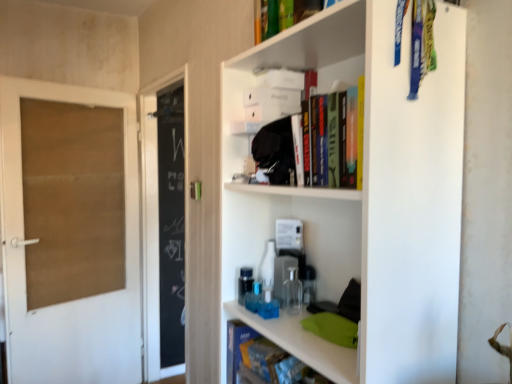
Where is `white matte shelf at upper right`? white matte shelf at upper right is located at coordinates tap(364, 196).

I want to click on brown cardboard door at left, so click(x=76, y=300).

Which is more to the right, hardcover book at upper center, positioned as the 2th book in back-to-front order, or blue matte book at lower center, which ranks as the first book in bottom-to-top order?

From the viewer's perspective, hardcover book at upper center, positioned as the 2th book in back-to-front order, appears more on the right side.

Does point (279, 17) come behind point (239, 322)?

No, (279, 17) is closer to viewer.

Measure the distance from hardcover book at upper center, positioned as the 2th book in back-to-front order, to blue matte book at lower center, which is the second book from top to bottom.

They are 30.84 inches apart.

Is hardcover book at upper center, positioned as the 2th book in back-to-front order, taller than blue matte book at lower center, which ranks as the first book in bottom-to-top order?

Correct, hardcover book at upper center, positioned as the 2th book in back-to-front order, is much taller as blue matte book at lower center, which ranks as the first book in bottom-to-top order.

Which is correct: white matte shelf at upper right is inside hardcover book at upper center, positioned as the 2th book in back-to-front order, or outside of it?

white matte shelf at upper right is spatially situated outside hardcover book at upper center, positioned as the 2th book in back-to-front order.

How many degrees apart are the facing directions of white matte shelf at upper right and hardcover book at upper center, the 2th book in the bottom-to-top sequence?

The angular difference between white matte shelf at upper right and hardcover book at upper center, the 2th book in the bottom-to-top sequence, is 3 degrees.

Is the depth of white matte shelf at upper right greater than that of hardcover book at upper center, positioned as the 2th book in back-to-front order?

No, white matte shelf at upper right is closer to the viewer.

From the image's perspective, is blue matte book at lower center, which is the second book from top to bottom, below hardcover book at upper center, arranged as the first book when viewed from the top?

Yes, from the image's perspective, blue matte book at lower center, which is the second book from top to bottom, is below hardcover book at upper center, arranged as the first book when viewed from the top.

Based on their positions, is blue matte book at lower center, positioned as the 2th book in front-to-back order, located to the left or right of hardcover book at upper center, positioned as the 2th book in back-to-front order?

blue matte book at lower center, positioned as the 2th book in front-to-back order, is to the left of hardcover book at upper center, positioned as the 2th book in back-to-front order.

Does blue matte book at lower center, positioned as the 2th book in front-to-back order, have a smaller size compared to hardcover book at upper center, positioned as the 2th book in back-to-front order?

Yes.

Is brown cardboard door at left positioned far away from hardcover book at upper center, positioned as the 2th book in back-to-front order?

Indeed, brown cardboard door at left is not near hardcover book at upper center, positioned as the 2th book in back-to-front order.

Who is shorter, brown cardboard door at left or hardcover book at upper center, the 2th book in the bottom-to-top sequence?

With less height is hardcover book at upper center, the 2th book in the bottom-to-top sequence.

At what (x,y) coordinates should I click in order to perform the action: click on book that is the 2nd object above the brown cardboard door at left (from a real-world perspective). Please return your answer as a coordinate pair (x, y). The width and height of the screenshot is (512, 384). Looking at the image, I should click on (282, 15).

Considering the sizes of objects brown cardboard door at left and hardcover book at upper center, positioned as the 2th book in back-to-front order, in the image provided, who is smaller, brown cardboard door at left or hardcover book at upper center, positioned as the 2th book in back-to-front order,?

hardcover book at upper center, positioned as the 2th book in back-to-front order, is smaller.

Is blue matte book at lower center, which ranks as the first book in bottom-to-top order, to the left of white matte shelf at upper right from the viewer's perspective?

Correct, you'll find blue matte book at lower center, which ranks as the first book in bottom-to-top order, to the left of white matte shelf at upper right.

From the image's perspective, which one is positioned higher, blue matte book at lower center, positioned as the 2th book in front-to-back order, or white matte shelf at upper right?

white matte shelf at upper right is shown above in the image.

Is blue matte book at lower center, which ranks as the first book in bottom-to-top order, positioned far away from white matte shelf at upper right?

No, blue matte book at lower center, which ranks as the first book in bottom-to-top order, is not far from white matte shelf at upper right.

How much distance is there between blue matte book at lower center, which ranks as the first book in bottom-to-top order, and white matte shelf at upper right?

A distance of 12.31 inches exists between blue matte book at lower center, which ranks as the first book in bottom-to-top order, and white matte shelf at upper right.

Is there a large distance between white matte shelf at upper right and blue matte book at lower center, positioned as the 2th book in front-to-back order?

No, white matte shelf at upper right is in close proximity to blue matte book at lower center, positioned as the 2th book in front-to-back order.

Does white matte shelf at upper right turn towards blue matte book at lower center, which ranks as the first book in bottom-to-top order?

Yes, white matte shelf at upper right faces towards blue matte book at lower center, which ranks as the first book in bottom-to-top order.

Which is behind, white matte shelf at upper right or blue matte book at lower center, which is the second book from top to bottom?

blue matte book at lower center, which is the second book from top to bottom, is more distant.

Which object is positioned more to the right, white matte shelf at upper right or blue matte book at lower center, which ranks as the first book in bottom-to-top order?

white matte shelf at upper right.

From the image's perspective, between brown cardboard door at left and blue matte book at lower center, which is the second book from top to bottom, which one is located above?

brown cardboard door at left.

Identify the location of the 1st book in front when counting from the brown cardboard door at left. (243, 341).

Is brown cardboard door at left touching blue matte book at lower center, which ranks as the first book in bottom-to-top order?

brown cardboard door at left and blue matte book at lower center, which ranks as the first book in bottom-to-top order, are clearly separated.

Which is behind, brown cardboard door at left or blue matte book at lower center, which is the 1th book in back-to-front order?

brown cardboard door at left.

You are a GUI agent. You are given a task and a screenshot of the screen. Output one action in this format:
    pyautogui.click(x=<x>, y=<y>)
    Task: Click on the book that appears in front of the blue matte book at lower center, which is the second book from top to bottom
    This screenshot has width=512, height=384.
    Given the screenshot: What is the action you would take?
    pyautogui.click(x=282, y=15)

I want to click on shelf on the right of hardcover book at upper center, positioned as the 2th book in back-to-front order, so click(364, 196).

Which object lies nearer to the anchor point blue matte book at lower center, which ranks as the first book in bottom-to-top order, white matte shelf at upper right or brown cardboard door at left?

white matte shelf at upper right is positioned closer to the anchor blue matte book at lower center, which ranks as the first book in bottom-to-top order.

Considering their positions, is blue matte book at lower center, which is the 1th book in back-to-front order, positioned further to brown cardboard door at left than white matte shelf at upper right?

white matte shelf at upper right is positioned further to the anchor brown cardboard door at left.

Considering their positions, is blue matte book at lower center, which ranks as the first book in bottom-to-top order, positioned further to brown cardboard door at left than hardcover book at upper center, arranged as the first book when viewed from the top?

Based on the image, hardcover book at upper center, arranged as the first book when viewed from the top, appears to be further to brown cardboard door at left.

Considering their positions, is brown cardboard door at left positioned closer to hardcover book at upper center, the 2th book in the bottom-to-top sequence, than white matte shelf at upper right?

Based on the image, white matte shelf at upper right appears to be nearer to hardcover book at upper center, the 2th book in the bottom-to-top sequence.

In the scene shown: Considering their positions, is blue matte book at lower center, positioned as the 2th book in front-to-back order, positioned further to hardcover book at upper center, arranged as the first book when viewed from the top, than white matte shelf at upper right?

Among the two, blue matte book at lower center, positioned as the 2th book in front-to-back order, is located further to hardcover book at upper center, arranged as the first book when viewed from the top.

Looking at the image, which one is located further to hardcover book at upper center, positioned as the 2th book in back-to-front order, white matte shelf at upper right or blue matte book at lower center, positioned as the 2th book in front-to-back order?

Based on the image, blue matte book at lower center, positioned as the 2th book in front-to-back order, appears to be further to hardcover book at upper center, positioned as the 2th book in back-to-front order.

Consider the image. Which object lies further to the anchor point brown cardboard door at left, white matte shelf at upper right or hardcover book at upper center, which is the 1th book from front to back?

The object further to brown cardboard door at left is white matte shelf at upper right.

Estimate the real-world distances between objects in this image. Which object is further from hardcover book at upper center, the 2th book in the bottom-to-top sequence, white matte shelf at upper right or brown cardboard door at left?

brown cardboard door at left lies further to hardcover book at upper center, the 2th book in the bottom-to-top sequence, than the other object.

Image resolution: width=512 pixels, height=384 pixels. Find the location of `book positioned between hardcover book at upper center, arranged as the first book when viewed from the top, and brown cardboard door at left from near to far`. book positioned between hardcover book at upper center, arranged as the first book when viewed from the top, and brown cardboard door at left from near to far is located at coordinates (243, 341).

Image resolution: width=512 pixels, height=384 pixels. Find the location of `shelf between hardcover book at upper center, the 2th book in the bottom-to-top sequence, and blue matte book at lower center, which ranks as the first book in bottom-to-top order, in the vertical direction`. shelf between hardcover book at upper center, the 2th book in the bottom-to-top sequence, and blue matte book at lower center, which ranks as the first book in bottom-to-top order, in the vertical direction is located at coordinates (364, 196).